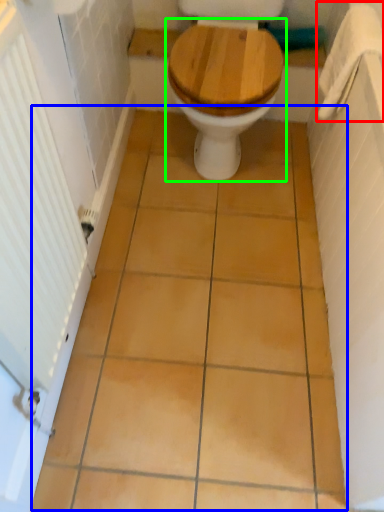
Question: Estimate the real-world distances between objects in this image. Which object is closer to towel bar (highlighted by a red box), ceramic tile (highlighted by a blue box) or toilet (highlighted by a green box)?

Choices:
 (A) ceramic tile
 (B) toilet

Answer: (B)